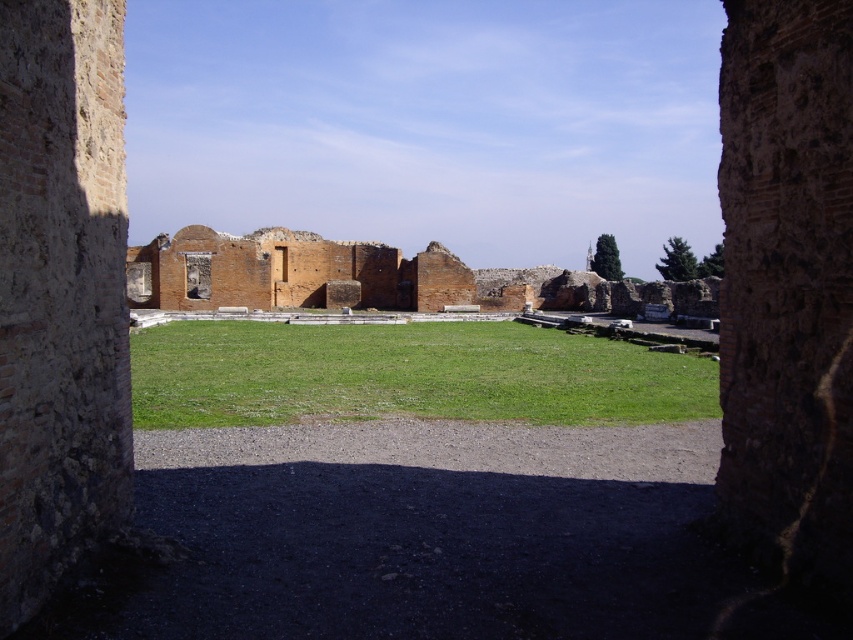
Question: Considering the relative positions of green grass at center and brick wall ruins at center in the image provided, where is green grass at center located with respect to brick wall ruins at center?

Choices:
 (A) below
 (B) above

Answer: (A)

Question: Does green grass at center have a lesser width compared to brick wall ruins at center?

Choices:
 (A) no
 (B) yes

Answer: (B)

Question: Observing the image, what is the correct spatial positioning of green grass at center in reference to brick wall ruins at center?

Choices:
 (A) right
 (B) left

Answer: (A)

Question: Which point is closer to the camera?

Choices:
 (A) (196, 228)
 (B) (641, 348)

Answer: (B)

Question: Among these points, which one is nearest to the camera?

Choices:
 (A) (469, 285)
 (B) (155, 422)

Answer: (B)